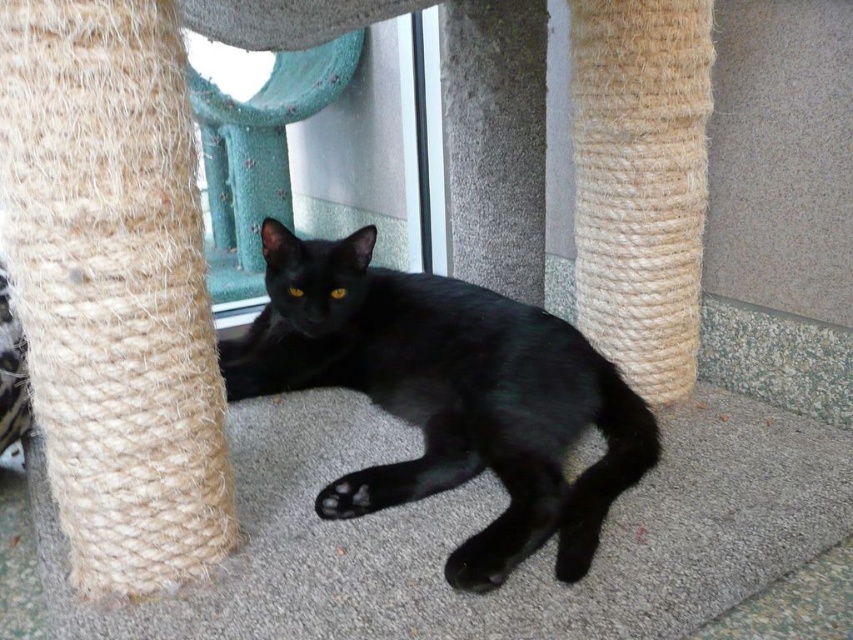
You are a delivery person approaching the entrance of a house. You see a black matte fur cat at center and a transparent glass door at center. Which object is closer to the entrance?

The transparent glass door at center is closer to the entrance because the black matte fur cat at center is positioned on the right side of it, meaning the door is in front of the cat from the delivery person perspective.

You are a delivery person who needs to enter through the transparent glass door at center. There is a black matte fur cat at center blocking your path. Can you walk around the cat without stepping on it?

The black matte fur cat at center is 59.57 centimeters away from the transparent glass door at center, so you have enough space to walk around the cat without stepping on it.